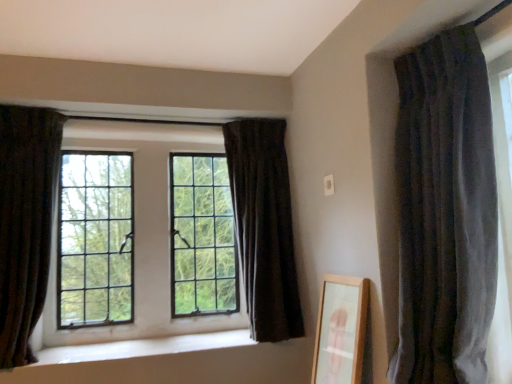
Question: Can you confirm if velvet dark gray curtain at right, the first curtain from the right, is thinner than dark velvet curtain at left, which ranks as the 1th curtain in left-to-right order?

Choices:
 (A) no
 (B) yes

Answer: (A)

Question: Is velvet dark gray curtain at right, which is counted as the third curtain, starting from the back, facing away from dark velvet curtain at left, positioned as the second curtain in front-to-back order?

Choices:
 (A) yes
 (B) no

Answer: (B)

Question: From a real-world perspective, is velvet dark gray curtain at right, the first curtain from the right, physically above dark velvet curtain at left, arranged as the 3th curtain when viewed from the right?

Choices:
 (A) yes
 (B) no

Answer: (B)

Question: Is velvet dark gray curtain at right, the third curtain from the left, surrounding dark velvet curtain at left, which ranks as the 1th curtain in left-to-right order?

Choices:
 (A) no
 (B) yes

Answer: (A)

Question: From the image's perspective, is velvet dark gray curtain at right, acting as the first curtain starting from the front, over dark velvet curtain at left, positioned as the second curtain in front-to-back order?

Choices:
 (A) yes
 (B) no

Answer: (A)

Question: Visually, is clear glass window at center positioned to the left or to the right of white smooth window sill at center?

Choices:
 (A) right
 (B) left

Answer: (B)

Question: Considering the positions of clear glass window at center and white smooth window sill at center in the image, is clear glass window at center taller or shorter than white smooth window sill at center?

Choices:
 (A) tall
 (B) short

Answer: (A)

Question: Considering the positions of point (201, 132) and point (183, 349), is point (201, 132) closer or farther from the camera than point (183, 349)?

Choices:
 (A) farther
 (B) closer

Answer: (A)

Question: Is clear glass window at center inside the boundaries of white smooth window sill at center, or outside?

Choices:
 (A) outside
 (B) inside

Answer: (A)

Question: From a real-world perspective, is velvet dark gray curtain at right, the third curtain from the left, above or below white smooth window sill at center?

Choices:
 (A) below
 (B) above

Answer: (B)

Question: In the image, is velvet dark gray curtain at right, acting as the first curtain starting from the front, positioned in front of or behind white smooth window sill at center?

Choices:
 (A) behind
 (B) front

Answer: (B)

Question: Considering the relative positions of velvet dark gray curtain at right, which is counted as the third curtain, starting from the back, and white smooth window sill at center in the image provided, is velvet dark gray curtain at right, which is counted as the third curtain, starting from the back, to the left or to the right of white smooth window sill at center?

Choices:
 (A) right
 (B) left

Answer: (A)

Question: From the image's perspective, relative to white smooth window sill at center, is velvet dark gray curtain at right, the first curtain from the right, above or below?

Choices:
 (A) above
 (B) below

Answer: (A)

Question: Looking at the image, does velvet dark gray curtain at right, the first curtain from the right, seem bigger or smaller compared to dark velvet curtain at center, marked as the second curtain in a right-to-left arrangement?

Choices:
 (A) big
 (B) small

Answer: (B)

Question: Is point (409, 152) closer or farther from the camera than point (282, 243)?

Choices:
 (A) farther
 (B) closer

Answer: (B)